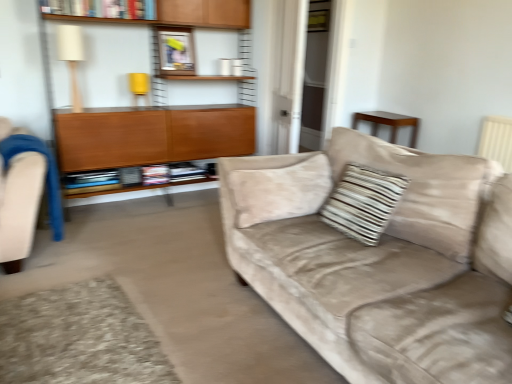
What is the approximate width of blue fabric swivel chair at left?

16.87 inches.

At what (x,y) coordinates should I click in order to perform the action: click on suede beige couch at center. Please return your answer as a coordinate pair (x, y). This screenshot has width=512, height=384. Looking at the image, I should click on (380, 261).

Measure the distance between point (150,14) and camera.

Point (150,14) is 3.30 meters away from camera.

Describe the element at coordinates (102, 189) in the screenshot. I see `wooden shelf at center, the first book when ordered from bottom to top` at that location.

This screenshot has height=384, width=512. I want to click on blue fabric swivel chair at left, so click(x=20, y=206).

From the image's perspective, relative to brown wooden table at upper right, is suede beige couch at center above or below?

suede beige couch at center is situated lower than brown wooden table at upper right in the image.

Is point (508, 357) farther from viewer compared to point (362, 114)?

No, (508, 357) is closer to viewer.

Which object is closer to the camera, suede beige couch at center or brown wooden table at upper right?

Positioned in front is suede beige couch at center.

Does blue fabric swivel chair at left have a larger size compared to white fabric lampshade at upper left?

Yes.

Is blue fabric swivel chair at left placed right next to white fabric lampshade at upper left?

No.

From a real-world perspective, is blue fabric swivel chair at left positioned under white fabric lampshade at upper left based on gravity?

Yes, from a real-world perspective, blue fabric swivel chair at left is beneath white fabric lampshade at upper left.

From the image's perspective, is blue fabric swivel chair at left over white fabric lampshade at upper left?

No, from the image's perspective, blue fabric swivel chair at left is not above white fabric lampshade at upper left.

Can you confirm if white fabric lampshade at upper left is taller than striped fabric pillow at center?

Correct, white fabric lampshade at upper left is much taller as striped fabric pillow at center.

Which is more to the left, white fabric lampshade at upper left or striped fabric pillow at center?

white fabric lampshade at upper left is more to the left.

How different are the orientations of white fabric lampshade at upper left and striped fabric pillow at center in degrees?

The facing directions of white fabric lampshade at upper left and striped fabric pillow at center are 99.8 degrees apart.

What are the coordinates of `picture frame on the right of blue fabric swivel chair at left` in the screenshot? It's located at (176, 50).

Is blue fabric swivel chair at left oriented away from metallic silver picture frame at upper center?

That's not correct — blue fabric swivel chair at left is not looking away from metallic silver picture frame at upper center.

Could you measure the distance between blue fabric swivel chair at left and metallic silver picture frame at upper center?

5.22 feet.

Which is behind, point (10, 186) or point (160, 29)?

The point (160, 29) is farther from the camera.

From a real-world perspective, who is located lower, suede beige couch at center or hardcover book at upper center, positioned as the 2th book in bottom-to-top order?

suede beige couch at center, from a real-world perspective.

From the image's perspective, which object appears higher, suede beige couch at center or hardcover book at upper center, which appears as the first book when viewed from the top?

From the image's view, hardcover book at upper center, which appears as the first book when viewed from the top, is above.

Does suede beige couch at center have a greater height compared to hardcover book at upper center, which appears as the first book when viewed from the top?

Yes, suede beige couch at center is taller than hardcover book at upper center, which appears as the first book when viewed from the top.

What's the angular difference between suede beige couch at center and hardcover book at upper center, which appears as the first book when viewed from the top,'s facing directions?

There is a 89.5-degree angle between the facing directions of suede beige couch at center and hardcover book at upper center, which appears as the first book when viewed from the top.

Would you say brown wooden table at upper right is inside or outside striped fabric pillow at center?

brown wooden table at upper right exists outside the volume of striped fabric pillow at center.

Does brown wooden table at upper right have a greater width compared to striped fabric pillow at center?

Yes, brown wooden table at upper right is wider than striped fabric pillow at center.

What's the angular difference between brown wooden table at upper right and striped fabric pillow at center's facing directions?

The angle between the facing direction of brown wooden table at upper right and the facing direction of striped fabric pillow at center is 7.94 degrees.

From a real-world perspective, who is located lower, brown wooden table at upper right or striped fabric pillow at center?

brown wooden table at upper right, from a real-world perspective.

Is wooden cabinet at left smaller than wooden shelf at center, marked as the 2th book in a top-to-bottom arrangement?

No, wooden cabinet at left is not smaller than wooden shelf at center, marked as the 2th book in a top-to-bottom arrangement.

From a real-world perspective, does wooden cabinet at left stand above wooden shelf at center, marked as the 2th book in a top-to-bottom arrangement?

Indeed, from a real-world perspective, wooden cabinet at left stands above wooden shelf at center, marked as the 2th book in a top-to-bottom arrangement.

Which is further, (222, 147) or (209, 161)?

The point (222, 147) is farther from the camera.

Visually, is wooden cabinet at left positioned to the left or to the right of wooden shelf at center, marked as the 2th book in a top-to-bottom arrangement?

wooden cabinet at left is positioned on wooden shelf at center, marked as the 2th book in a top-to-bottom arrangement,'s right side.

Image resolution: width=512 pixels, height=384 pixels. What are the coordinates of `studio couch below the brown wooden table at upper right (from a real-world perspective)` in the screenshot? It's located at (380, 261).

Identify the location of lamp above the blue fabric swivel chair at left (from a real-world perspective). This screenshot has width=512, height=384. (71, 58).

Which object lies nearer to the anchor point brown wooden table at upper right, wooden cabinet at left or hardcover book at upper center, which appears as the first book when viewed from the top?

wooden cabinet at left is closer to brown wooden table at upper right.

From the image, which object appears to be farther from suede beige couch at center, white fabric lampshade at upper left or brown wooden table at upper right?

brown wooden table at upper right is further to suede beige couch at center.

From the image, which object appears to be nearer to blue fabric swivel chair at left, wooden shelf at center, marked as the 2th book in a top-to-bottom arrangement, or suede beige couch at center?

wooden shelf at center, marked as the 2th book in a top-to-bottom arrangement, is positioned closer to the anchor blue fabric swivel chair at left.

Which object lies further to the anchor point metallic silver picture frame at upper center, suede beige couch at center or brown wooden table at upper right?

suede beige couch at center.

When comparing their distances from striped fabric pillow at center, does metallic silver picture frame at upper center or white fabric lampshade at upper left seem closer?

metallic silver picture frame at upper center lies closer to striped fabric pillow at center than the other object.

Looking at this image, estimate the real-world distances between objects in this image. Which object is further from metallic silver picture frame at upper center, brown wooden table at upper right or wooden shelf at center, marked as the 2th book in a top-to-bottom arrangement?

Among the two, brown wooden table at upper right is located further to metallic silver picture frame at upper center.

Looking at the image, which one is located closer to wooden shelf at center, the first book when ordered from bottom to top, wooden cabinet at left or brown wooden table at upper right?

Based on the image, wooden cabinet at left appears to be nearer to wooden shelf at center, the first book when ordered from bottom to top.

Looking at the image, which one is located further to striped fabric pillow at center, wooden shelf at center, marked as the 2th book in a top-to-bottom arrangement, or brown wooden table at upper right?

brown wooden table at upper right is further to striped fabric pillow at center.

At what (x,y) coordinates should I click in order to perform the action: click on book between hardcover book at upper center, positioned as the 2th book in bottom-to-top order, and striped fabric pillow at center, in the horizontal direction. Please return your answer as a coordinate pair (x, y). This screenshot has height=384, width=512. Looking at the image, I should click on (102, 189).

Locate an element on the screen. The image size is (512, 384). throw pillow between wooden shelf at center, marked as the 2th book in a top-to-bottom arrangement, and brown wooden table at upper right is located at coordinates (362, 202).

What are the coordinates of `bookcase between white fabric lampshade at upper left and wooden shelf at center, the first book when ordered from bottom to top, vertically` in the screenshot? It's located at (167, 142).

Where is `bookcase between hardcover book at upper center, positioned as the 2th book in bottom-to-top order, and blue fabric swivel chair at left in the up-down direction`? This screenshot has height=384, width=512. bookcase between hardcover book at upper center, positioned as the 2th book in bottom-to-top order, and blue fabric swivel chair at left in the up-down direction is located at coordinates (167, 142).